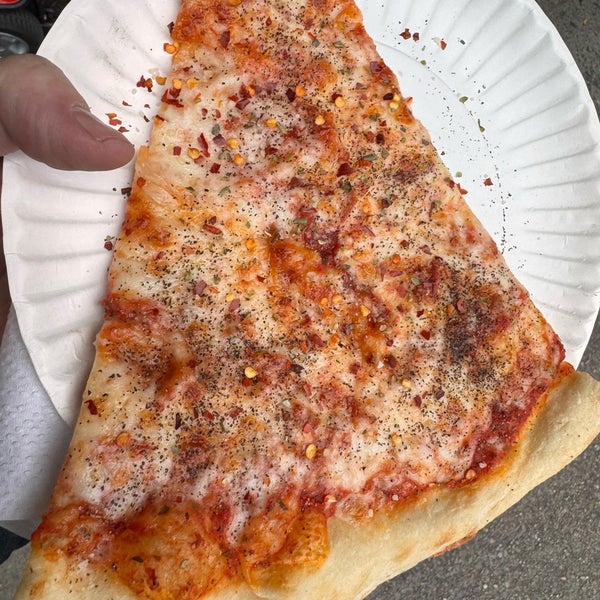
I want to click on paper plate, so click(559, 192).